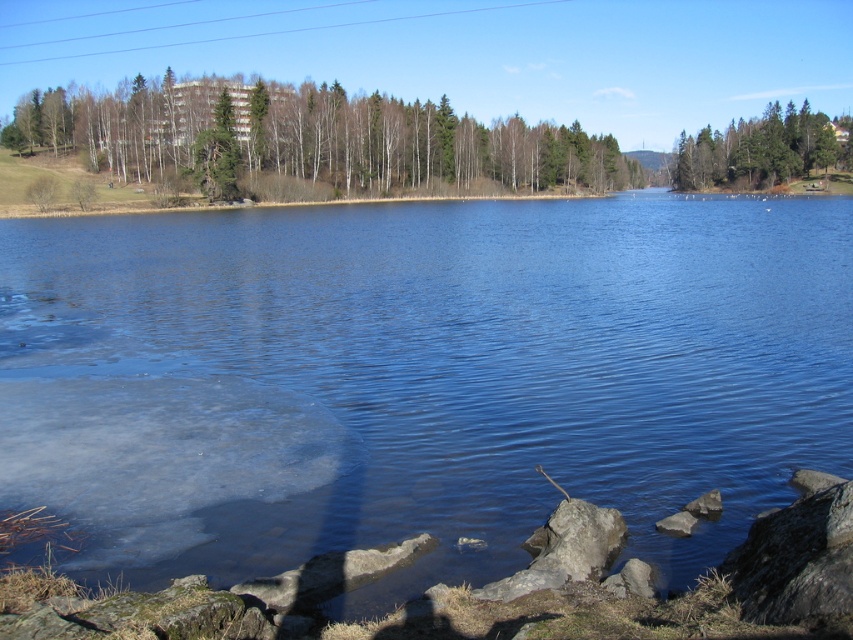
Question: Considering the real-world distances, which object is closest to the green textured trees at upper right?

Choices:
 (A) green leafy trees at upper left
 (B) blue water at center
 (C) rough textured rock at lower right
 (D) gray rock at lower right

Answer: (A)

Question: Which point is farther from the camera taking this photo?

Choices:
 (A) (712, 492)
 (B) (265, 268)
 (C) (674, 531)
 (D) (756, 156)

Answer: (D)

Question: Among these objects, which one is nearest to the camera?

Choices:
 (A) rough textured rock at lower right
 (B) smooth gray rock at lower right
 (C) blue water at center

Answer: (A)

Question: Is green leafy trees at upper left thinner than rough textured rock at lower right?

Choices:
 (A) no
 (B) yes

Answer: (A)

Question: Does green leafy trees at upper left have a lesser width compared to smooth gray rock at lower right?

Choices:
 (A) yes
 (B) no

Answer: (B)

Question: Is blue water at center smaller than green leafy trees at upper left?

Choices:
 (A) no
 (B) yes

Answer: (B)